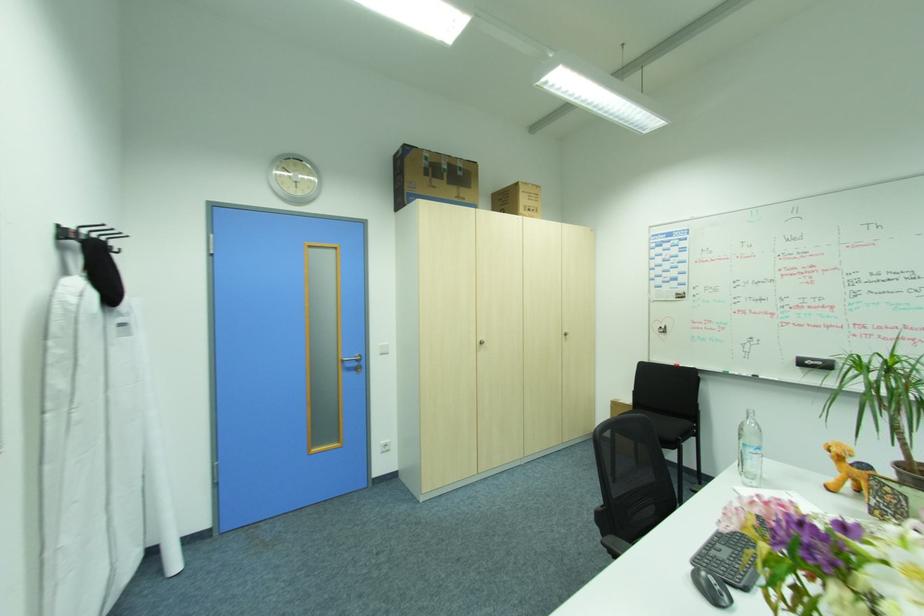
You are a GUI agent. You are given a task and a screenshot of the screen. Output one action in this format:
    pyautogui.click(x=<x>, y=<y>)
    Task: Click on the chair sitting surface
    
    Given the screenshot: What is the action you would take?
    pyautogui.click(x=665, y=422)